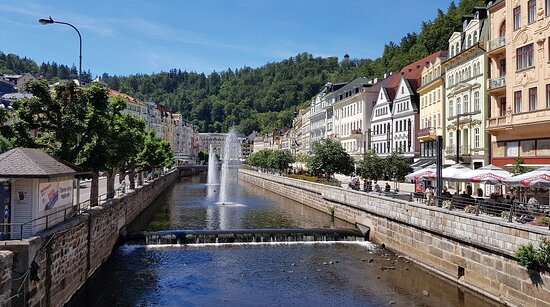
Identify the location of plant. (527, 255).